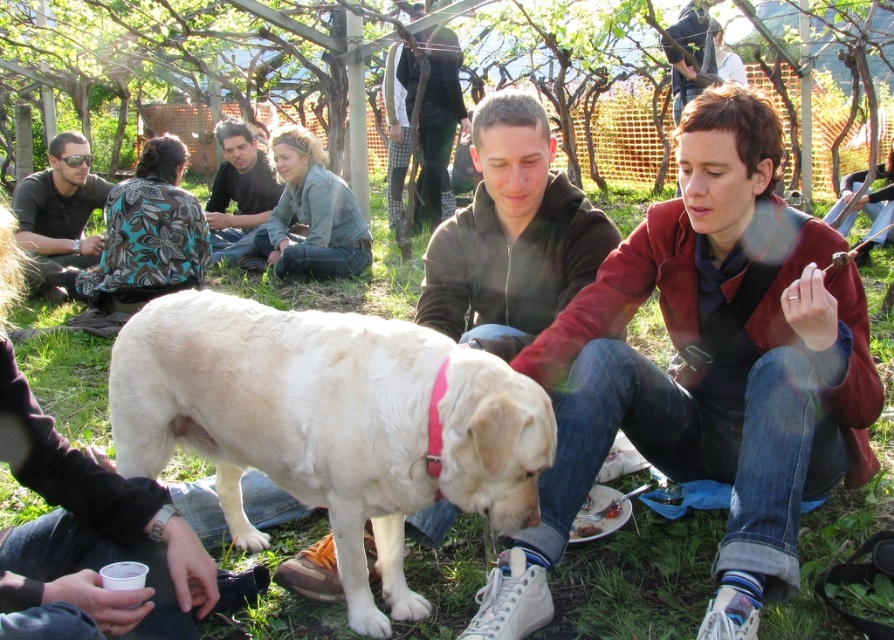
You are planning to set up a picnic blanket between the matte brown jacket at center and the smooth brown shirt at center. If the picnic blanket is 3 meters long, will it fit between them without overlapping either?

The distance between the matte brown jacket at center and the smooth brown shirt at center is 4.38 meters. Since the picnic blanket is only 3 meters long, it will fit between them with 1.38 meters of space remaining on either side.

You are standing at the point labeled point (34, 195) and want to walk towards the point labeled point (420, 129). Which direction should you head?

You should head backward because point (34, 195) is in front of point (420, 129).

You are a photographer trying to capture the scene. You notice a point at coordinates (x=58, y=216). Which object in the scene is this point located on?

The point at coordinates (x=58, y=216) is located on the matte black jacket at upper left.